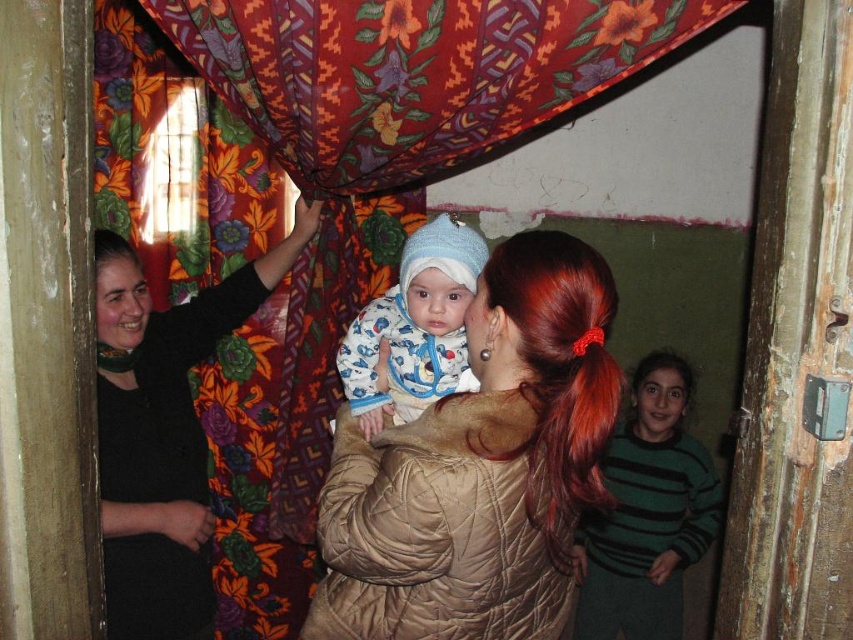
Question: Which is nearer to the knitted blue hat at center?

Choices:
 (A) matte brown coat at center
 (B) green striped sweater at right

Answer: (A)

Question: Can you confirm if matte brown coat at center is smaller than black fabric at left?

Choices:
 (A) yes
 (B) no

Answer: (A)

Question: Among these objects, which one is farthest from the camera?

Choices:
 (A) black fabric at left
 (B) green striped sweater at right
 (C) knitted blue hat at center

Answer: (B)

Question: Observing the image, what is the correct spatial positioning of green striped sweater at right in reference to knitted blue hat at center?

Choices:
 (A) right
 (B) left

Answer: (A)

Question: Can you confirm if black fabric at left is bigger than green striped sweater at right?

Choices:
 (A) no
 (B) yes

Answer: (B)

Question: Which object is closer to the camera taking this photo?

Choices:
 (A) green striped sweater at right
 (B) knitted blue hat at center
 (C) matte brown coat at center
 (D) black fabric at left

Answer: (C)